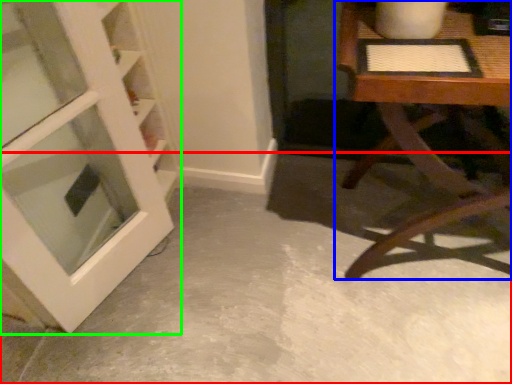
Question: Estimate the real-world distances between objects in this image. Which object is closer to concrete (highlighted by a red box), table (highlighted by a blue box) or door (highlighted by a green box)?

Choices:
 (A) table
 (B) door

Answer: (A)